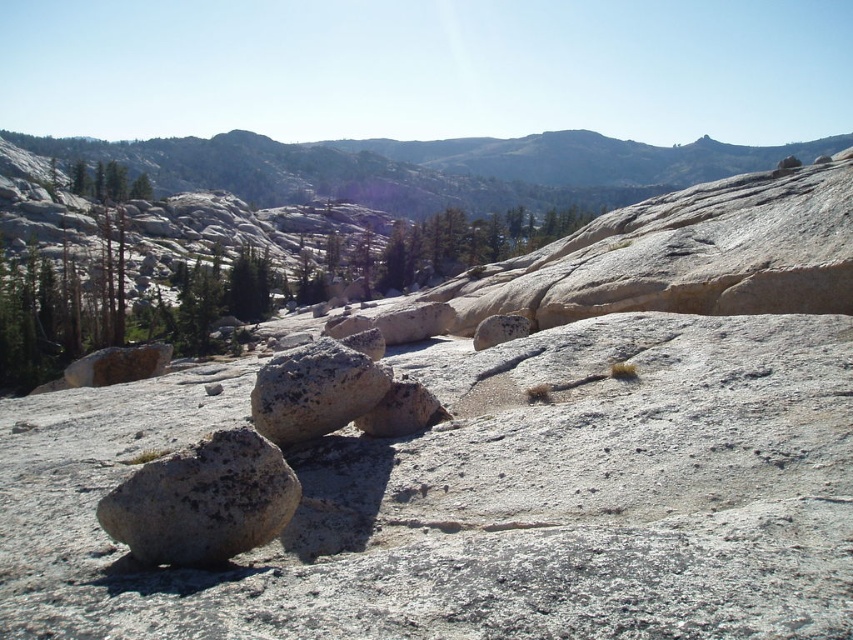
Does gray rough rock at lower left appear on the left side of smooth gray rock at center?

Correct, you'll find gray rough rock at lower left to the left of smooth gray rock at center.

Measure the distance between gray rough rock at lower left and camera.

gray rough rock at lower left and camera are 6.34 meters apart from each other.

Measure the distance between point (196, 548) and camera.

A distance of 6.47 meters exists between point (196, 548) and camera.

Find the location of a particular element. Image resolution: width=853 pixels, height=640 pixels. gray rough rock at lower left is located at coordinates (202, 500).

Which is above, gray rough rock at lower left or rusty metallic rock at center?

rusty metallic rock at center is higher up.

Locate an element on the screen. The width and height of the screenshot is (853, 640). gray rough rock at lower left is located at coordinates (202, 500).

Does green matte tree at upper left have a greater width compared to smooth gray rock at center?

Yes, green matte tree at upper left is wider than smooth gray rock at center.

From the picture: Which is below, green matte tree at upper left or smooth gray rock at center?

smooth gray rock at center is lower down.

The width and height of the screenshot is (853, 640). What are the coordinates of `green matte tree at upper left` in the screenshot? It's located at (108, 180).

Locate an element on the screen. Image resolution: width=853 pixels, height=640 pixels. green matte tree at upper left is located at coordinates (108, 180).